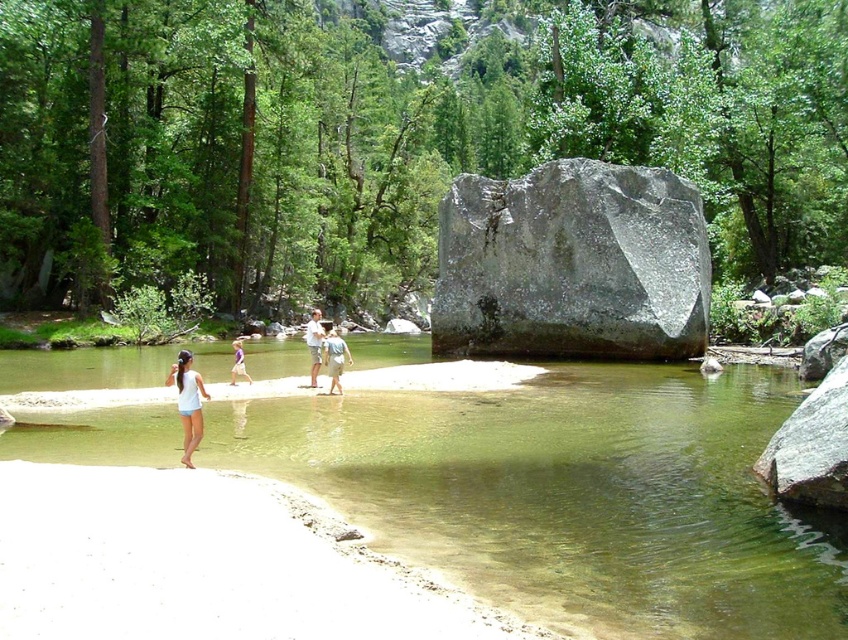
Question: Which point is closer to the camera?

Choices:
 (A) gray/granite boulder at center
 (B) gray smooth rock at lower right
 (C) white cotton tank top at lower left

Answer: (B)

Question: Which of the following is the farthest from the observer?

Choices:
 (A) (336, 348)
 (B) (192, 426)

Answer: (A)

Question: Can you confirm if white cotton tank top at lower left is positioned below light brown fabric shirt at center?

Choices:
 (A) no
 (B) yes

Answer: (B)

Question: Which point is farther to the camera?

Choices:
 (A) (530, 353)
 (B) (197, 376)
 (C) (805, 419)
 (D) (313, 330)

Answer: (A)

Question: Can you confirm if white cotton tank top at lower left is positioned to the right of light blue denim shorts at center?

Choices:
 (A) yes
 (B) no

Answer: (B)

Question: Does gray/granite boulder at center have a greater width compared to gray smooth rock at lower right?

Choices:
 (A) no
 (B) yes

Answer: (B)